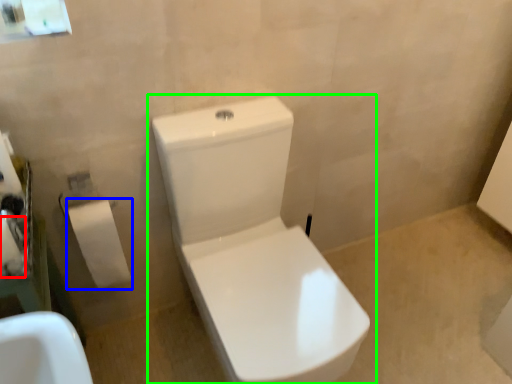
Question: Considering the real-world distances, which object is closest to toilet paper (highlighted by a red box)? toiletry (highlighted by a blue box) or toilet (highlighted by a green box).

Choices:
 (A) toiletry
 (B) toilet

Answer: (A)